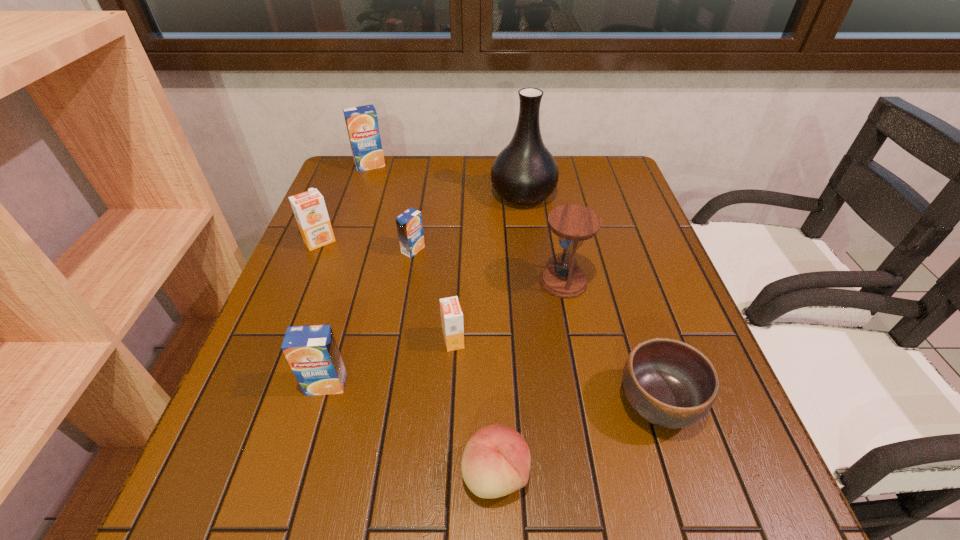
This screenshot has height=540, width=960. In the image, there is a desktop. Identify the location of vacant region at the near edge. (618, 475).

Image resolution: width=960 pixels, height=540 pixels. I want to click on vacant space at the left edge of the desktop, so click(x=298, y=456).

Locate an element on the screen. vacant space at the right edge of the desktop is located at coordinates (635, 280).

This screenshot has height=540, width=960. In the image, there is a desktop. In order to click on vacant space at the far left corner in this screenshot , I will do `click(340, 161)`.

The height and width of the screenshot is (540, 960). I want to click on vacant space that's between the peach and the nearest orange juice, so click(411, 429).

You are a GUI agent. You are given a task and a screenshot of the screen. Output one action in this format:
    pyautogui.click(x=<x>, y=<y>)
    Task: Click on the free space between the farthest orange juice and the second nearest blue orange_juice
    The image size is (960, 540).
    Given the screenshot: What is the action you would take?
    pyautogui.click(x=392, y=207)

What are the coordinates of `free point between the right orange orange juice and the nearest blue orange_juice` in the screenshot? It's located at (390, 362).

What are the coordinates of `free space between the fifth nearest object and the bowl` in the screenshot? It's located at (611, 342).

Identify the location of unoccupied position between the second farthest blue orange_juice and the nearest orange juice. Image resolution: width=960 pixels, height=540 pixels. (370, 317).

Locate an element on the screen. The width and height of the screenshot is (960, 540). free space between the nearer orange orange juice and the peach is located at coordinates (474, 407).